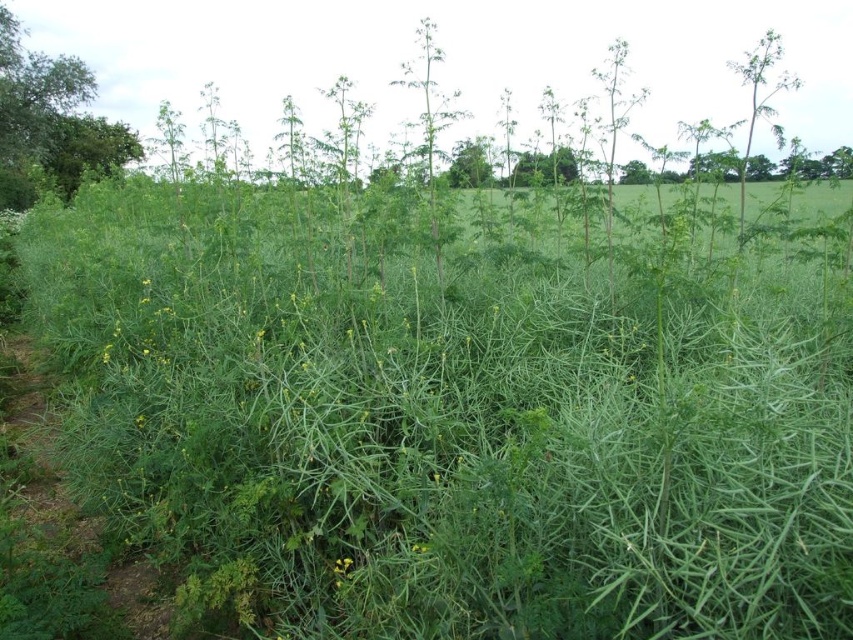
Does green leafy grass at center have a smaller size compared to green leafy tree at upper left?

Actually, green leafy grass at center might be larger than green leafy tree at upper left.

From the picture: Which of these two, green leafy grass at center or green leafy tree at upper left, stands taller?

green leafy tree at upper left is taller.

Does point (589, 451) come in front of point (50, 156)?

That is True.

Image resolution: width=853 pixels, height=640 pixels. I want to click on green leafy grass at center, so pyautogui.click(x=450, y=422).